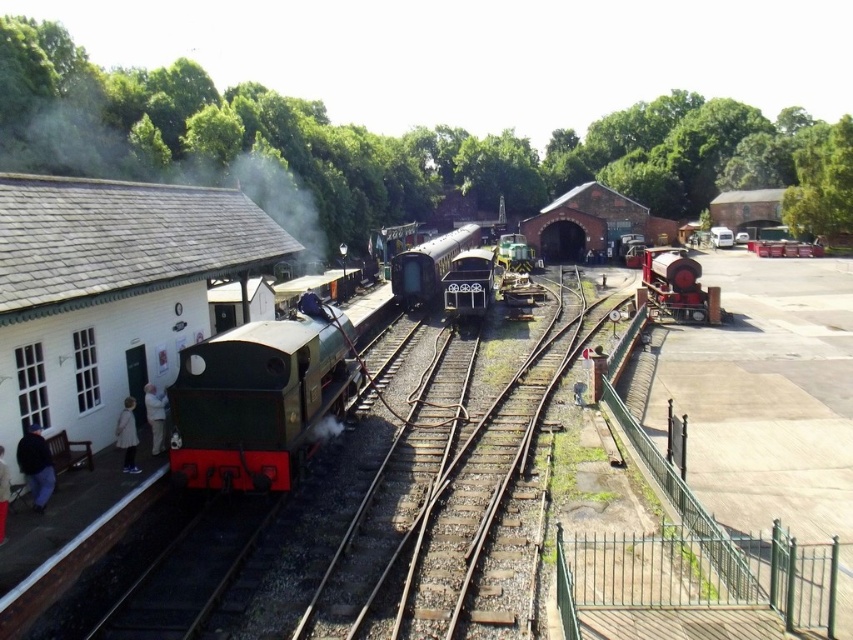
You are a photographer standing at the railway station and want to take a photo of both the point at coordinates point (151, 392) and point (3, 490). Which point is closer to your camera position?

Point (3, 490) is closer to the camera position because it is less further than point (151, 392).

You are standing at the railway station and want to know which of the two points, point (135, 433) or point (149, 417), is nearer to you. Can you determine this based on the scene?

Point (135, 433) is closer to the viewer than point (149, 417).